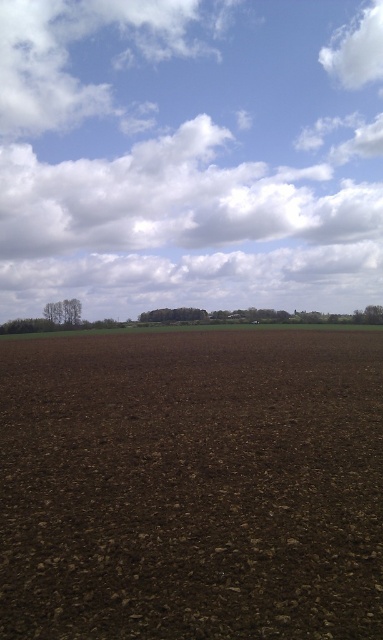
Is point (196, 506) in front of point (343, 32)?

Yes.

Is dark brown soil at center to the right of white fluffy cloud at upper right from the viewer's perspective?

Incorrect, dark brown soil at center is not on the right side of white fluffy cloud at upper right.

Which is behind, point (353, 380) or point (376, 20)?

The point (376, 20) is behind.

Identify the location of dark brown soil at center. The image size is (383, 640). (191, 484).

Can you confirm if white fluffy clouds at upper center is wider than white fluffy cloud at upper right?

Yes.

Between point (70, 33) and point (356, 51), which one is positioned behind?

The point (70, 33) is behind.

Which is in front, point (338, 211) or point (343, 61)?

Point (338, 211) is in front.

Locate an element on the screen. The image size is (383, 640). white fluffy clouds at upper center is located at coordinates (184, 157).

Is white fluffy clouds at upper center shorter than dark brown soil at center?

In fact, white fluffy clouds at upper center may be taller than dark brown soil at center.

Who is lower down, white fluffy clouds at upper center or dark brown soil at center?

Positioned lower is dark brown soil at center.

The width and height of the screenshot is (383, 640). What do you see at coordinates (184, 157) in the screenshot?
I see `white fluffy clouds at upper center` at bounding box center [184, 157].

In order to click on white fluffy clouds at upper center in this screenshot , I will do `click(184, 157)`.